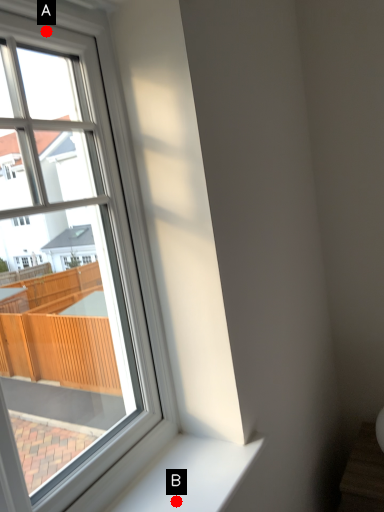
Question: Two points are circled on the image, labeled by A and B beside each circle. Which point appears closest to the camera in this image?

Choices:
 (A) A is closer
 (B) B is closer

Answer: (A)